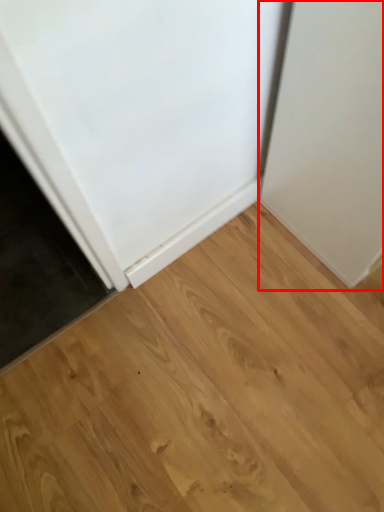
Question: From the image's perspective, what is the correct spatial relationship of door (annotated by the red box) in relation to hardwood?

Choices:
 (A) above
 (B) below

Answer: (A)